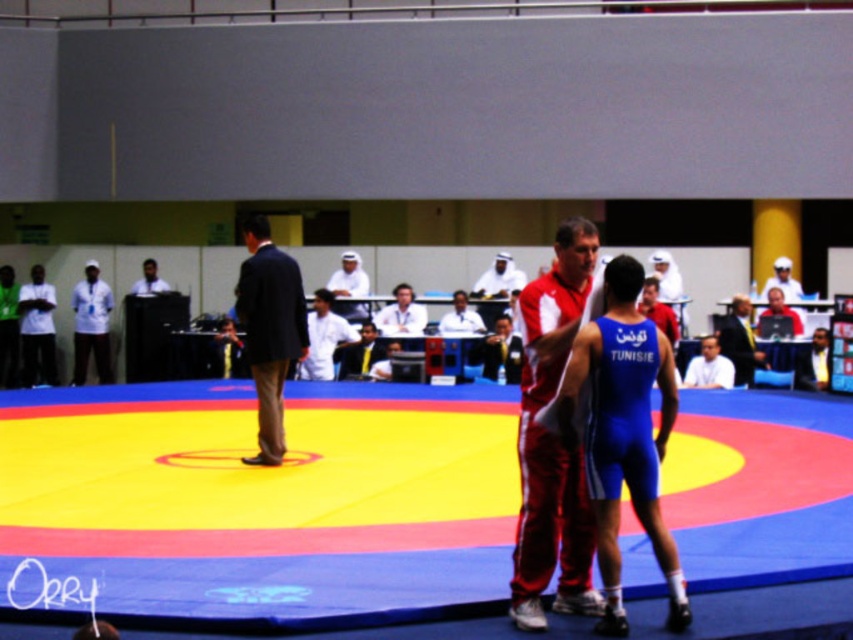
Which is more to the right, dark suit at center or blue fabric suit at center?

Positioned to the right is blue fabric suit at center.

Which of these two, dark suit at center or blue fabric suit at center, stands shorter?

With less height is blue fabric suit at center.

Does point (248, 227) come closer to viewer compared to point (717, 337)?

Yes, it is in front of point (717, 337).

Identify the location of dark suit at center. The image size is (853, 640). (270, 330).

Does red track suit at center appear over blue fabric suit at center?

Incorrect, red track suit at center is not positioned above blue fabric suit at center.

Image resolution: width=853 pixels, height=640 pixels. What do you see at coordinates (552, 440) in the screenshot?
I see `red track suit at center` at bounding box center [552, 440].

Where is `red track suit at center`? The image size is (853, 640). red track suit at center is located at coordinates pos(552,440).

Who is more forward, (569, 236) or (259, 276)?

Positioned in front is point (569, 236).

Is point (572, 566) positioned before point (257, 358)?

Yes.

This screenshot has width=853, height=640. Find the location of `red track suit at center`. red track suit at center is located at coordinates (552, 440).